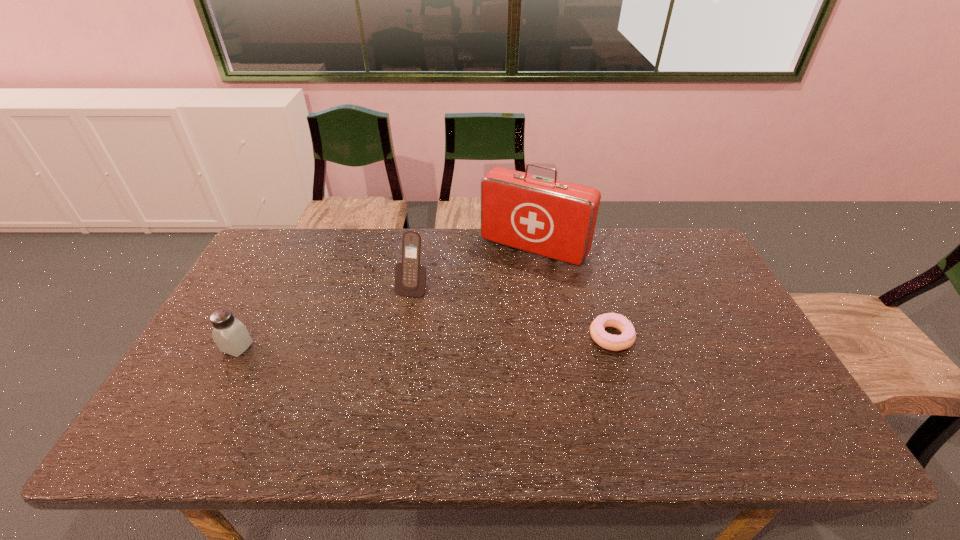
Find the location of `blank region between the shortest object and the second farthest object`. blank region between the shortest object and the second farthest object is located at coordinates (512, 312).

This screenshot has height=540, width=960. Identify the location of blank region between the cellular telephone and the leftmost object. (324, 317).

Find the location of `object that is the closest to the leftmost object`. object that is the closest to the leftmost object is located at coordinates (410, 277).

Locate an element on the screen. the closest object to the doughnut is located at coordinates (556, 219).

The width and height of the screenshot is (960, 540). Identify the location of vacant position in the image that satisfies the following two spatial constraints: 1. on the front side of the shortest object; 2. on the left side of the first-aid kit. (547, 336).